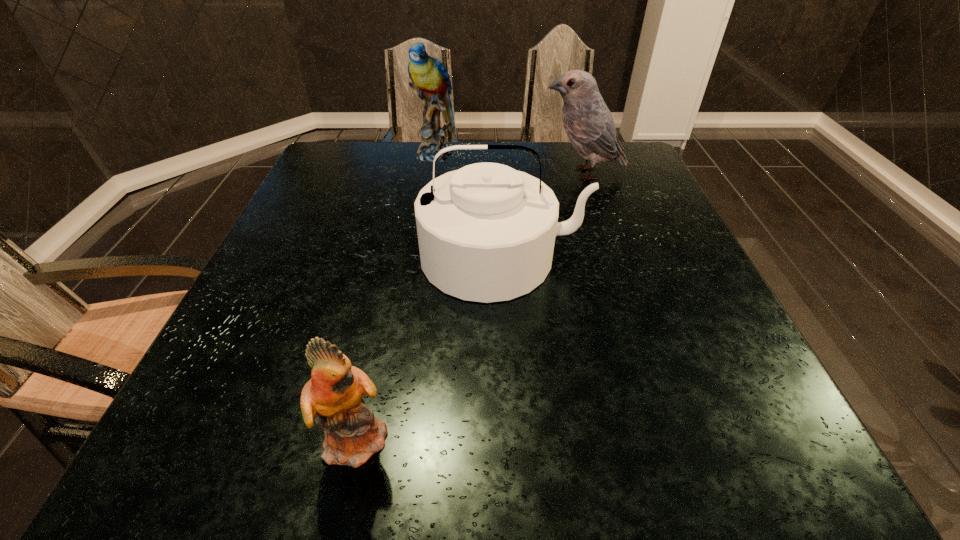
Where is `object that is at the far right corner`? The width and height of the screenshot is (960, 540). object that is at the far right corner is located at coordinates (587, 121).

The width and height of the screenshot is (960, 540). I want to click on free space at the far edge, so click(x=420, y=181).

This screenshot has width=960, height=540. I want to click on vacant space at the near edge, so click(299, 430).

Locate an element on the screen. free space at the left edge of the desktop is located at coordinates (317, 198).

Locate an element on the screen. This screenshot has height=540, width=960. free space at the right edge is located at coordinates (649, 204).

In the image, there is a desktop. Where is `vacant space at the far left corner`? The image size is (960, 540). vacant space at the far left corner is located at coordinates (329, 178).

Where is `free space at the near right corner of the desktop`? This screenshot has height=540, width=960. free space at the near right corner of the desktop is located at coordinates (728, 435).

Where is `vacant region between the nearest object and the rightmost parrot`? The width and height of the screenshot is (960, 540). vacant region between the nearest object and the rightmost parrot is located at coordinates (470, 305).

The width and height of the screenshot is (960, 540). What are the coordinates of `free spot between the nearest parrot and the kettle` in the screenshot? It's located at (x=430, y=347).

Find the location of a particular element. This screenshot has width=960, height=540. empty space between the third farthest object and the nearest parrot is located at coordinates (430, 347).